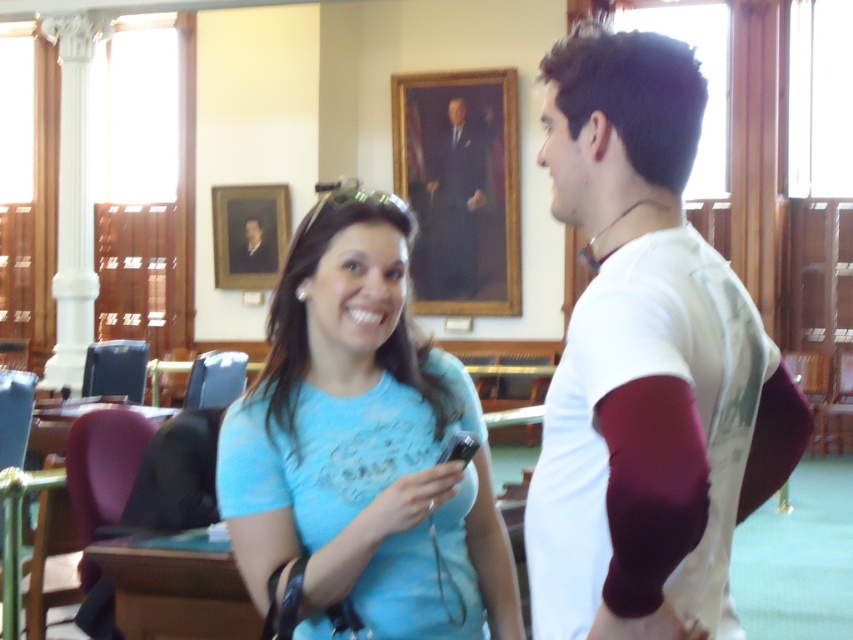
You are standing in the room and want to greet both the blue cotton shirt at center and the formal suit at center. If you start from the left side of the room, which person should you approach first?

The formal suit at center is to the left of the blue cotton shirt at center, so you should approach the formal suit at center first when starting from the left side of the room.

You are a photographer standing in the room and want to take a photo of both the blue cotton shirt at center and the matte blue shirt at center. The camera has a minimum focus distance of 20 inches. Will both shirts be in focus?

The blue cotton shirt at center and the matte blue shirt at center are 20.16 inches apart. Since the distance between them is greater than the camera minimum focus distance of 20 inches, both shirts will be in focus.